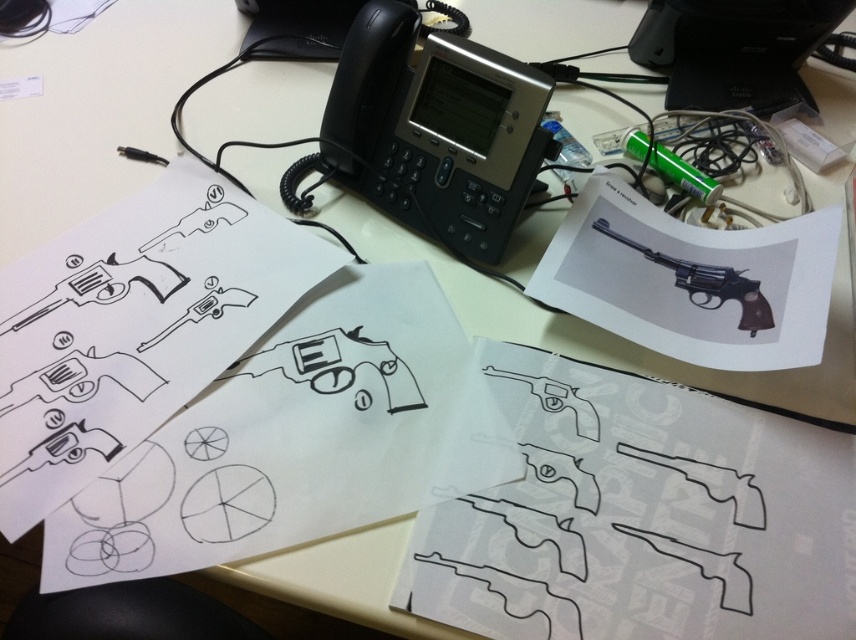
Is the position of black plastic phone at center more distant than that of matte black revolver at upper right?

That is True.

Is point (408, 12) behind point (601, 189)?

No.

The image size is (856, 640). Find the location of `black plastic phone at center`. black plastic phone at center is located at coordinates (431, 131).

Between black paper at center and black rubber revolver at upper right, which one has less height?

With less height is black rubber revolver at upper right.

Is black paper at center to the left of black rubber revolver at upper right from the viewer's perspective?

Correct, you'll find black paper at center to the left of black rubber revolver at upper right.

This screenshot has height=640, width=856. What do you see at coordinates (298, 440) in the screenshot?
I see `black paper at center` at bounding box center [298, 440].

Where is `black paper at center`? Image resolution: width=856 pixels, height=640 pixels. black paper at center is located at coordinates (298, 440).

Is black line drawing revolver at upper left smaller than black line drawing revolver at center?

Actually, black line drawing revolver at upper left might be larger than black line drawing revolver at center.

Is black line drawing revolver at upper left to the right of black line drawing revolver at center from the viewer's perspective?

Incorrect, black line drawing revolver at upper left is not on the right side of black line drawing revolver at center.

Does point (162, 296) lie behind point (204, 310)?

Yes.

The image size is (856, 640). Identify the location of black line drawing revolver at upper left. (100, 288).